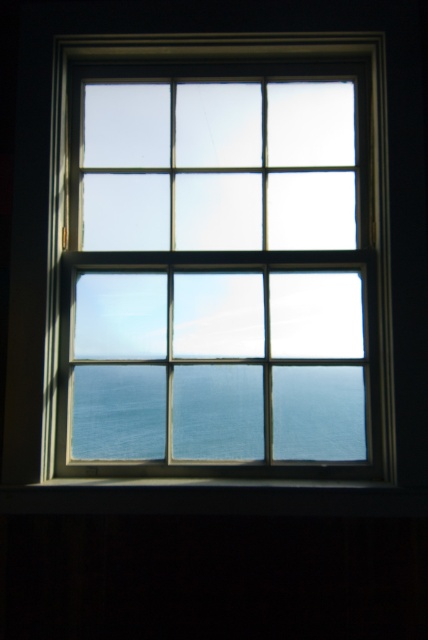
You are an interior designer assessing the window in the image. You need to determine if the dark wood paneling at bottom and the blue glassy water at center can both be fully visible in a photograph taken from the room. Based on their sizes, will both fit within the frame?

The dark wood paneling at bottom is larger in size than blue glassy water at center, so both can fit within the frame as long as the camera is positioned to include the entire dark wood paneling at bottom and blue glassy water at center.

You have a small painting that is 10 cm wide. You want to hang it on either the clear glass window at center or the dark wood paneling at bottom. Which surface can it fit on if the painting must be placed entirely within the surface?

The clear glass window at center is thinner than the dark wood paneling at bottom. Since the painting is 10 cm wide, it can fit on either surface as both are wider than 10 cm. However, the question might be about thickness, but since the painting is placed on the surface, width is the determining factor here. The answer might need clarification, but based on the given description, both surfaces can accommodate the painting.

You are a painter standing 30 inches away from the clear glass window at center. You want to reach the dark wood paneling at bottom to adjust a hanging picture frame. Can you do this without moving your feet?

The distance between the clear glass window at center and the dark wood paneling at bottom is 25.53 inches. Since you are 30 inches away from the window, you can stretch your arm to reach the paneling as the distance is less than your reach. Yes, you can adjust the frame without moving your feet.